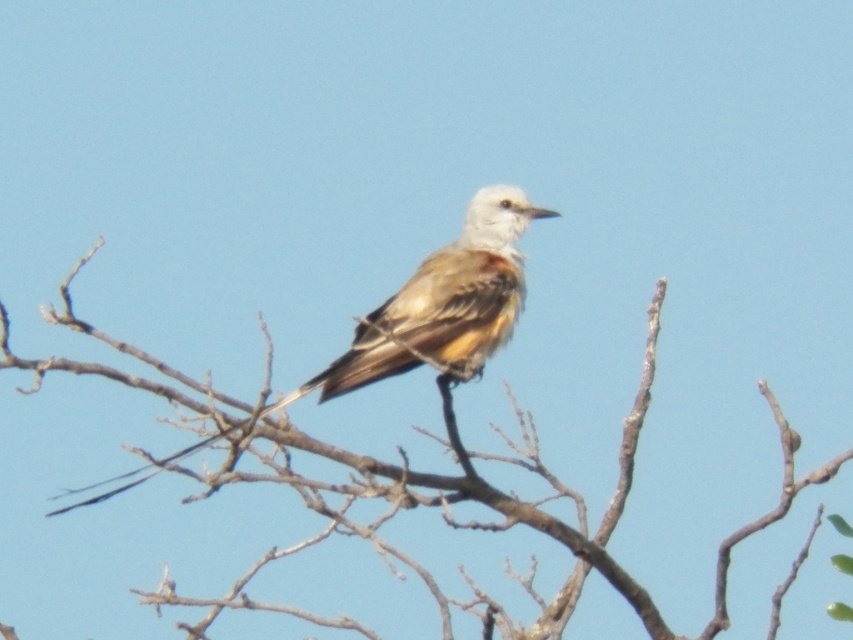
Question: Which point appears closest to the camera in this image?

Choices:
 (A) (444, 342)
 (B) (767, 525)

Answer: (B)

Question: Which point is closer to the camera?

Choices:
 (A) brown textured branch at center
 (B) brown feathered bird at center

Answer: (A)

Question: Is brown textured branch at center smaller than brown feathered bird at center?

Choices:
 (A) yes
 (B) no

Answer: (B)

Question: Is brown textured branch at center bigger than brown feathered bird at center?

Choices:
 (A) yes
 (B) no

Answer: (A)

Question: Is brown textured branch at center wider than brown feathered bird at center?

Choices:
 (A) yes
 (B) no

Answer: (A)